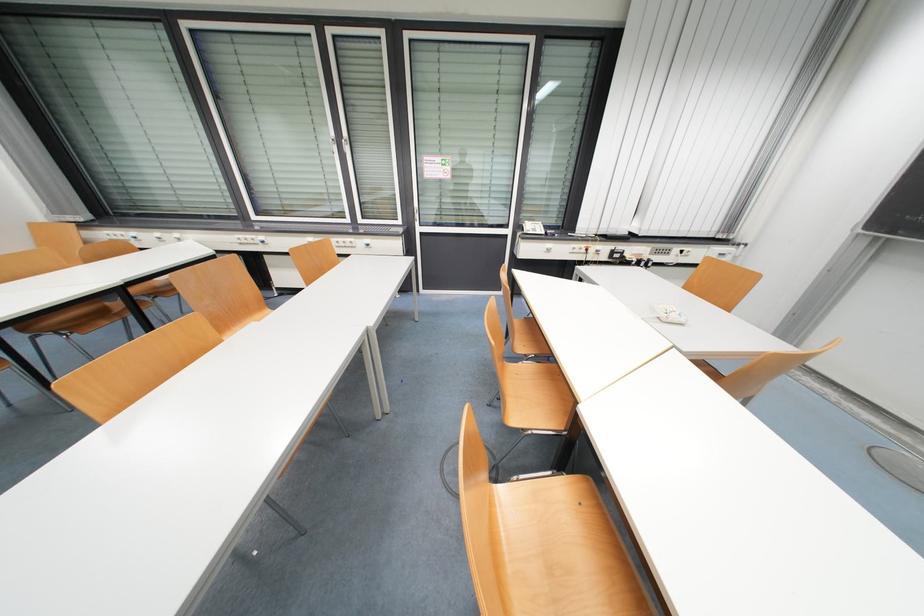
Which object does [532,227] point to?

It corresponds to the telephone handset in the image.